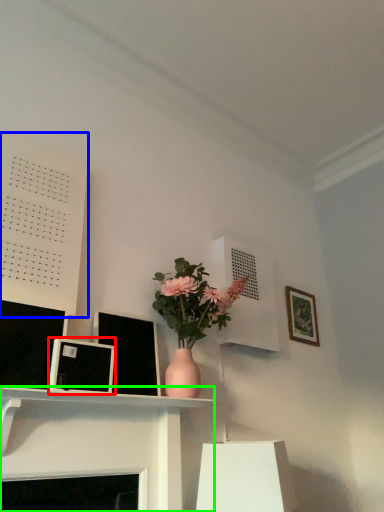
Question: Which is farther away from picture frame (highlighted by a red box)? bulletin board (highlighted by a blue box) or shelf (highlighted by a green box)?

Choices:
 (A) bulletin board
 (B) shelf

Answer: (A)